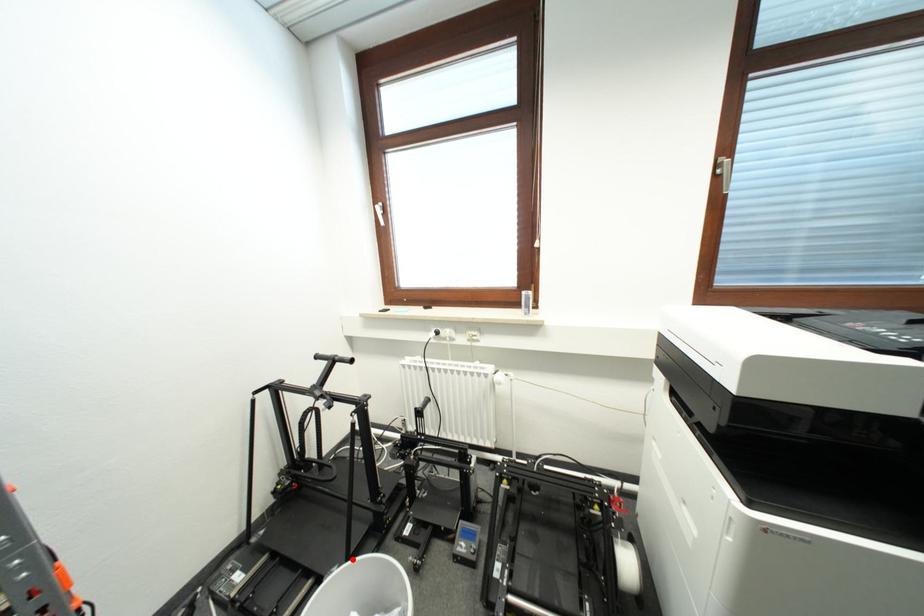
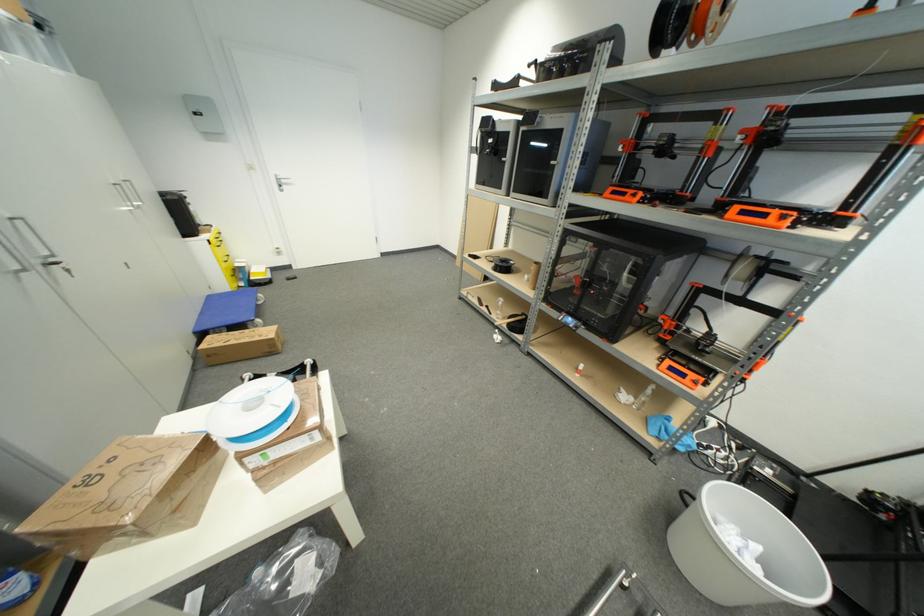
The point at the highlighted location is marked in the first image. Where is the corresponding point in the second image?

(821, 560)